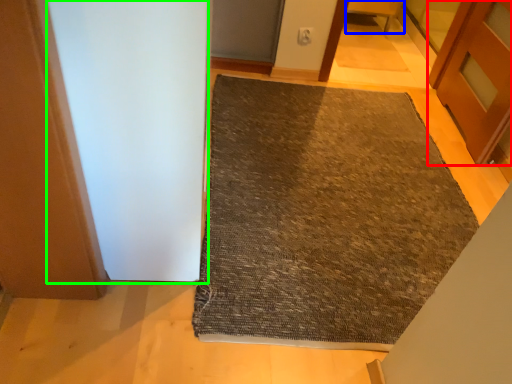
Question: Which object is the farthest from door (highlighted by a red box)? Choose among these: furniture (highlighted by a blue box) or screen door (highlighted by a green box).

Choices:
 (A) furniture
 (B) screen door

Answer: (B)